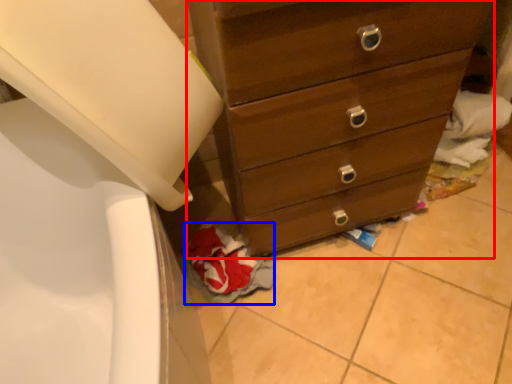
Question: Which object appears farthest to the camera in this image, chest of drawers (highlighted by a red box) or material (highlighted by a blue box)?

Choices:
 (A) chest of drawers
 (B) material

Answer: (B)